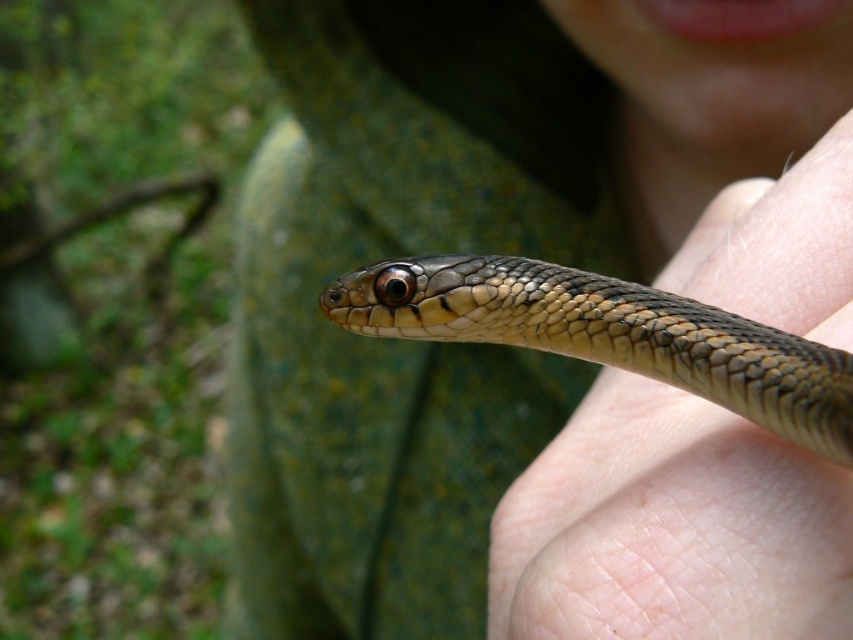
Question: Can you confirm if smooth skin at center is wider than shiny brown snake at center?

Choices:
 (A) yes
 (B) no

Answer: (B)

Question: Which object is positioned closest to the smooth skin hand at center?

Choices:
 (A) smooth skin at center
 (B) shiny brown snake at center

Answer: (A)

Question: Which object is the closest to the shiny brown snake at center?

Choices:
 (A) smooth skin at center
 (B) smooth skin hand at center

Answer: (A)

Question: From the image, what is the correct spatial relationship of smooth skin at center in relation to shiny brown snake at center?

Choices:
 (A) left
 (B) right

Answer: (B)

Question: Which point appears farthest from the camera in this image?

Choices:
 (A) (712, 608)
 (B) (392, 365)

Answer: (B)

Question: Can you confirm if smooth skin at center is wider than shiny brown snake at center?

Choices:
 (A) no
 (B) yes

Answer: (A)